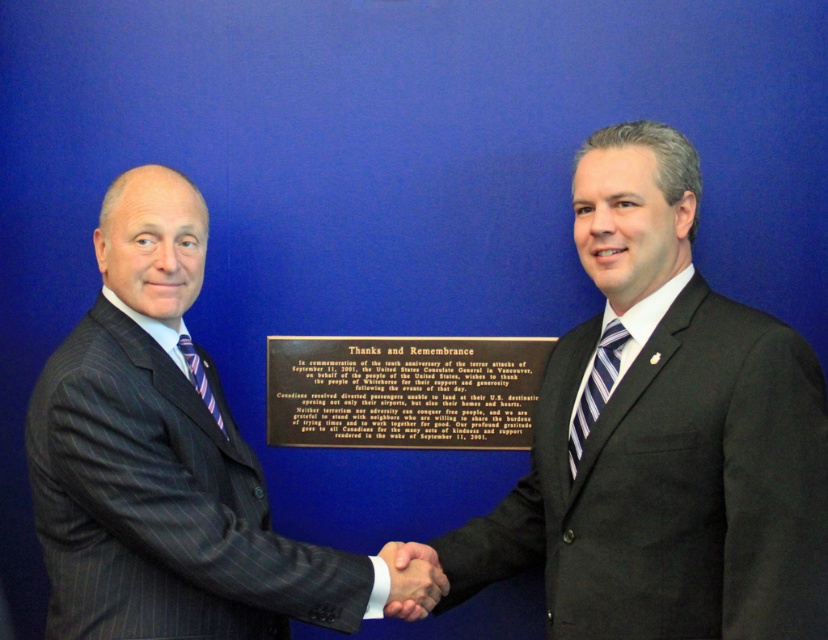
Question: Which object is the farthest from the striped fabric tie at center?

Choices:
 (A) dark gray pinstripe suit at center
 (B) striped fabric tie at left
 (C) smooth skin handshake at center

Answer: (A)

Question: Among these objects, which one is farthest from the camera?

Choices:
 (A) matte black suit at center
 (B) striped fabric tie at center
 (C) striped fabric tie at left

Answer: (C)

Question: Does dark gray pinstripe suit at center appear on the left side of smooth skin handshake at center?

Choices:
 (A) yes
 (B) no

Answer: (A)

Question: Which object appears farthest from the camera in this image?

Choices:
 (A) smooth skin handshake at center
 (B) matte black suit at center
 (C) striped fabric tie at center
 (D) striped fabric tie at left

Answer: (D)

Question: Is matte black suit at center closer to the viewer compared to dark gray pinstripe suit at center?

Choices:
 (A) yes
 (B) no

Answer: (A)

Question: Can you confirm if dark gray pinstripe suit at center is positioned above smooth skin handshake at center?

Choices:
 (A) yes
 (B) no

Answer: (A)